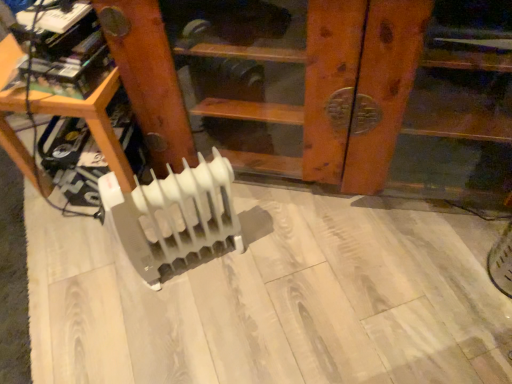
Question: From a real-world perspective, is white plastic radiator at lower center, positioned as the 1th furniture in left-to-right order, positioned above or below white plastic radiator at center, which is the second furniture in left-to-right order?

Choices:
 (A) below
 (B) above

Answer: (A)

Question: Considering the positions of white plastic radiator at lower center, positioned as the 1th furniture in left-to-right order, and white plastic radiator at center, which is the 1th furniture from right to left, in the image, is white plastic radiator at lower center, positioned as the 1th furniture in left-to-right order, bigger or smaller than white plastic radiator at center, which is the 1th furniture from right to left,?

Choices:
 (A) big
 (B) small

Answer: (B)

Question: Estimate the real-world distances between objects in this image. Which object is closer to the white plastic radiator at center, which is the 1th furniture from right to left?

Choices:
 (A) white plastic radiator at center
 (B) white plastic radiator at lower center, which is the 2th furniture from right to left

Answer: (A)

Question: Estimate the real-world distances between objects in this image. Which object is farther from the white plastic radiator at center?

Choices:
 (A) white plastic radiator at lower center, which is the 2th furniture from right to left
 (B) white plastic radiator at center, which is the 1th furniture from right to left

Answer: (B)